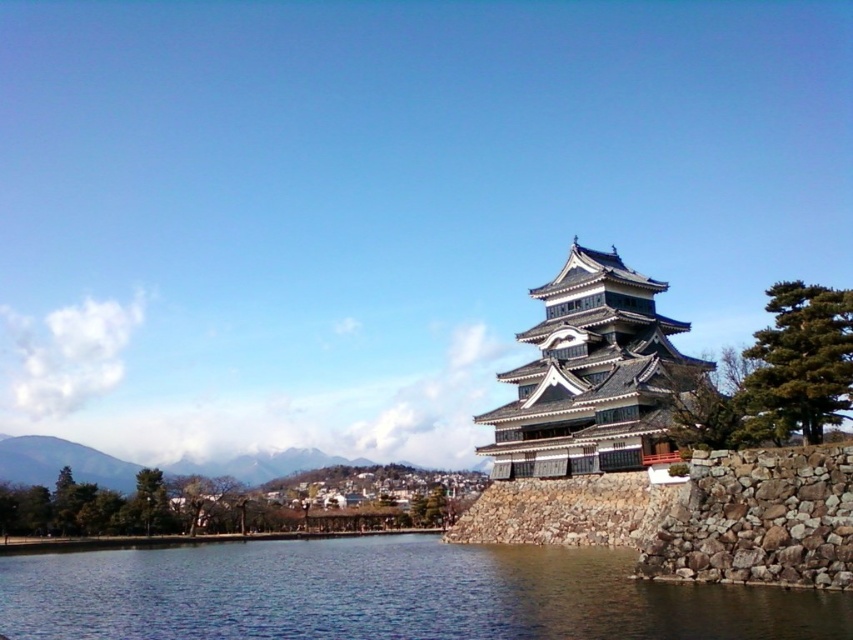
Question: Does blue water at lower left have a smaller size compared to gray stone tower at center?

Choices:
 (A) no
 (B) yes

Answer: (A)

Question: From the image, what is the correct spatial relationship of blue water at lower left in relation to gray stone tower at center?

Choices:
 (A) above
 (B) below

Answer: (B)

Question: Is blue water at lower left positioned in front of gray stone tower at center?

Choices:
 (A) yes
 (B) no

Answer: (A)

Question: Which point is closer to the camera?

Choices:
 (A) blue water at lower left
 (B) gray stone tower at center

Answer: (A)

Question: Among these objects, which one is nearest to the camera?

Choices:
 (A) gray stone tower at center
 (B) blue water at lower left

Answer: (B)